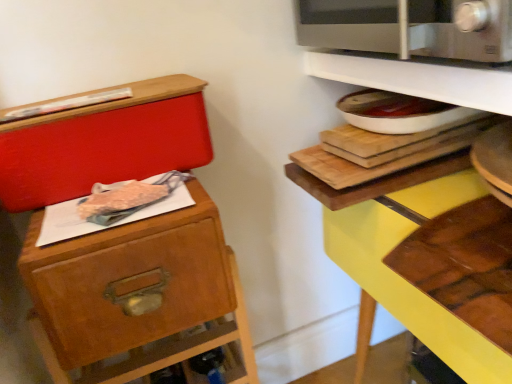
Where is `free location above matte red box at upper left (from a real-world perspective)`? This screenshot has width=512, height=384. free location above matte red box at upper left (from a real-world perspective) is located at coordinates pyautogui.click(x=79, y=97).